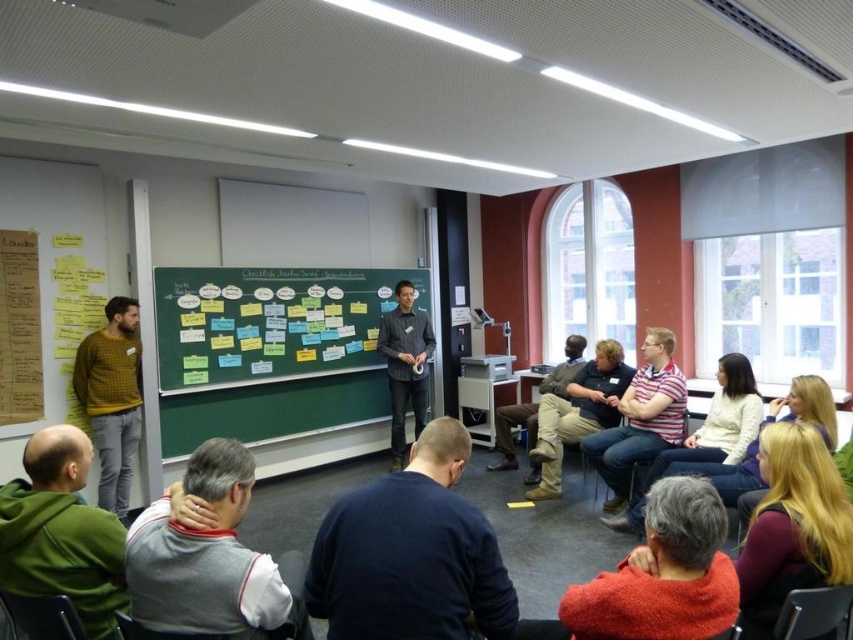
Describe the element at coordinates (206, 556) in the screenshot. The width and height of the screenshot is (853, 640). I see `gray fleece jacket at lower left` at that location.

Who is shorter, gray fleece jacket at lower left or khaki corduroy pants at center?

gray fleece jacket at lower left

Who is more forward, (135,577) or (602,385)?

Point (135,577)

Identify the location of gray fleece jacket at lower left. The height and width of the screenshot is (640, 853). (206, 556).

Who is shorter, gray fleece jacket at lower left or dark gray shirt at center?

gray fleece jacket at lower left

Is point (157, 531) in front of point (399, 305)?

Yes, it is.

Find the location of a particular element. gray fleece jacket at lower left is located at coordinates (206, 556).

Is point (102, 612) behind point (816, 621)?

No.

Can you confirm if green fleece jacket at lower left is shorter than metallic silver chair at lower right?

No.

You are a GUI agent. You are given a task and a screenshot of the screen. Output one action in this format:
    pyautogui.click(x=<x>, y=<y>)
    Task: Click on the green fleece jacket at lower left
    This screenshot has width=853, height=640.
    Given the screenshot: What is the action you would take?
    pyautogui.click(x=61, y=532)